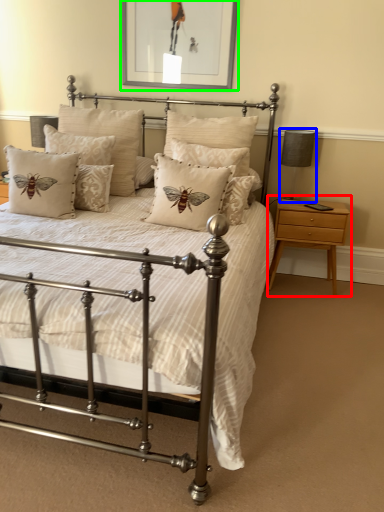
Question: Considering the real-world distances, which object is closest to nightstand (highlighted by a red box)? table lamp (highlighted by a blue box) or picture frame (highlighted by a green box).

Choices:
 (A) table lamp
 (B) picture frame

Answer: (A)